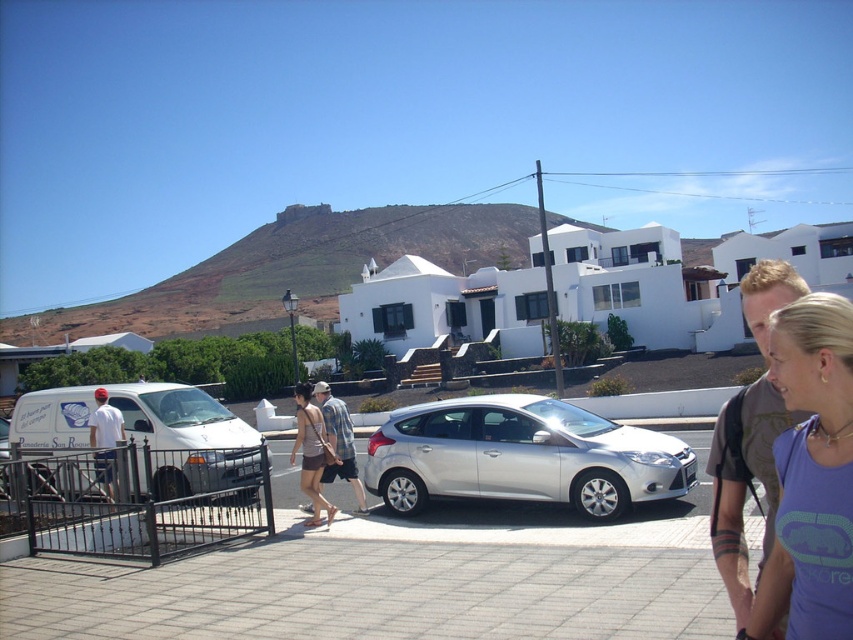
Question: Which object is farther from the camera taking this photo?

Choices:
 (A) purple cotton tank top at lower right
 (B) matte brown shorts at center

Answer: (B)

Question: Which point is farther from the camera taking this photo?

Choices:
 (A) pos(299,384)
 (B) pos(341,449)

Answer: (A)

Question: Which is nearer to the purple cotton tank top at lower right?

Choices:
 (A) silver metallic hatchback at center
 (B) white matte van at left
 (C) white matte shirt at left
 (D) plaid fabric shirt at center

Answer: (A)

Question: From the image, what is the correct spatial relationship of purple cotton tank top at lower right in relation to matte brown shorts at center?

Choices:
 (A) right
 (B) left

Answer: (A)

Question: Does purple cotton tank top at lower right appear under white matte shirt at left?

Choices:
 (A) no
 (B) yes

Answer: (A)

Question: Is purple cotton tank top at lower right to the left of white matte van at left from the viewer's perspective?

Choices:
 (A) yes
 (B) no

Answer: (B)